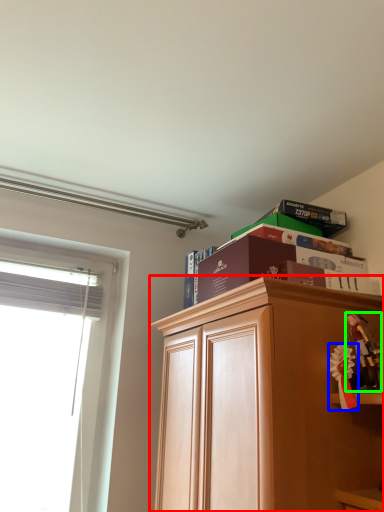
Question: Which object is the farthest from cabinetry (highlighted by a red box)? Choose among these: toy (highlighted by a blue box) or toy (highlighted by a green box).

Choices:
 (A) toy
 (B) toy

Answer: (B)